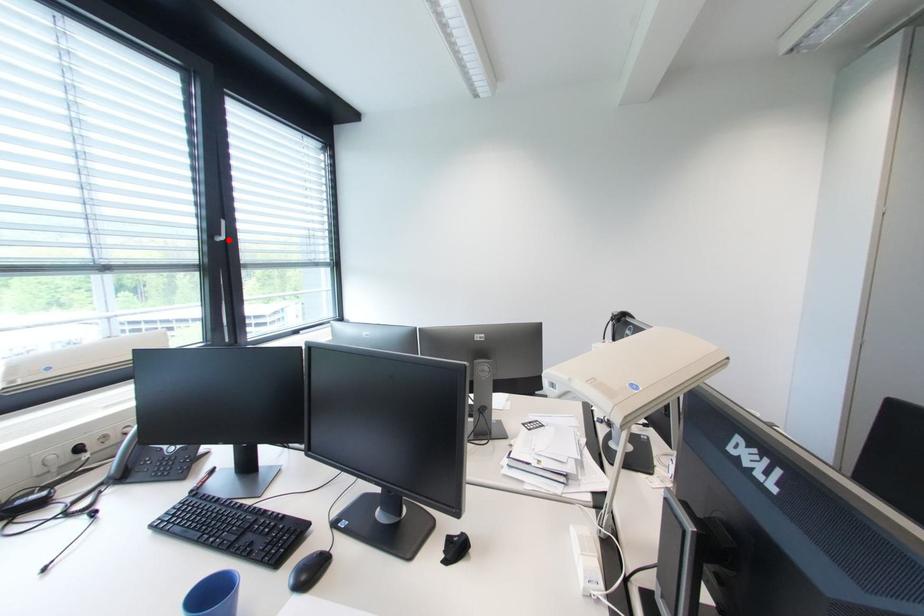
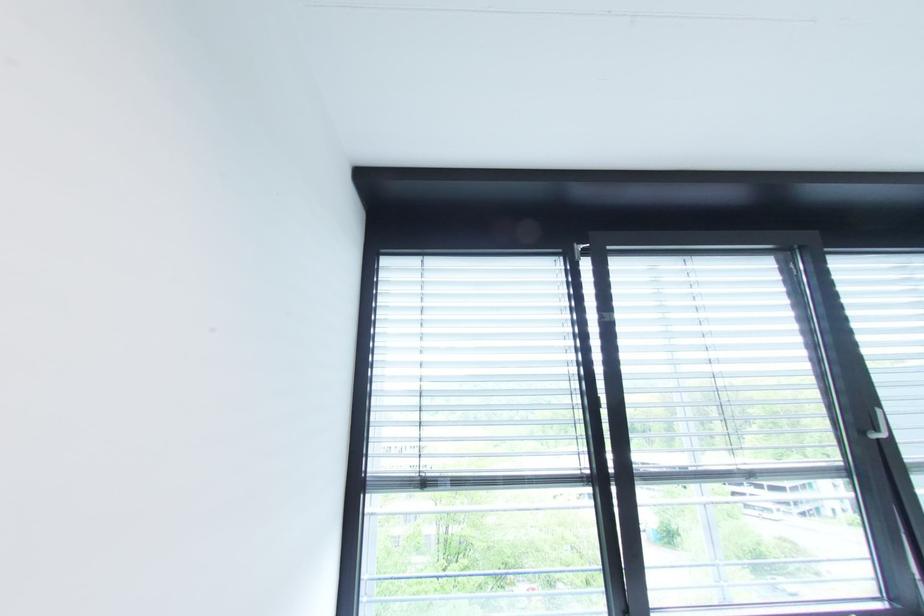
In the second image, find the point that corresponds to the highlighted location in the first image.

(889, 437)